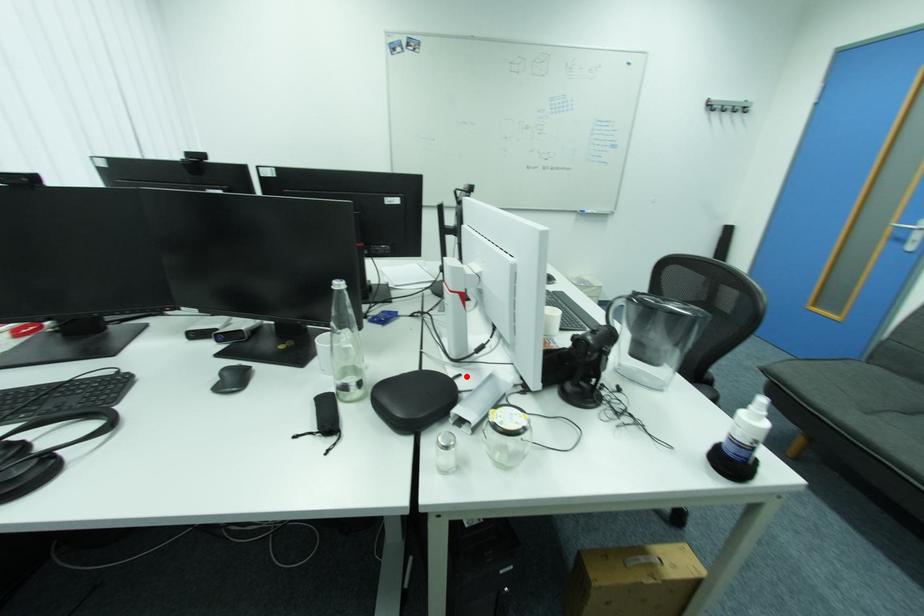
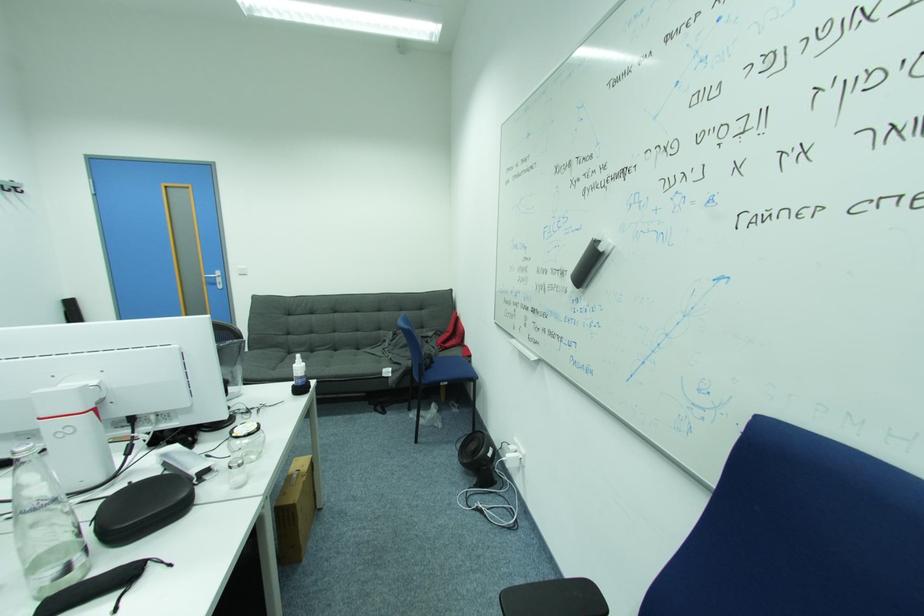
The point at the highlighted location is marked in the first image. Where is the corresponding point in the second image?

(138, 484)